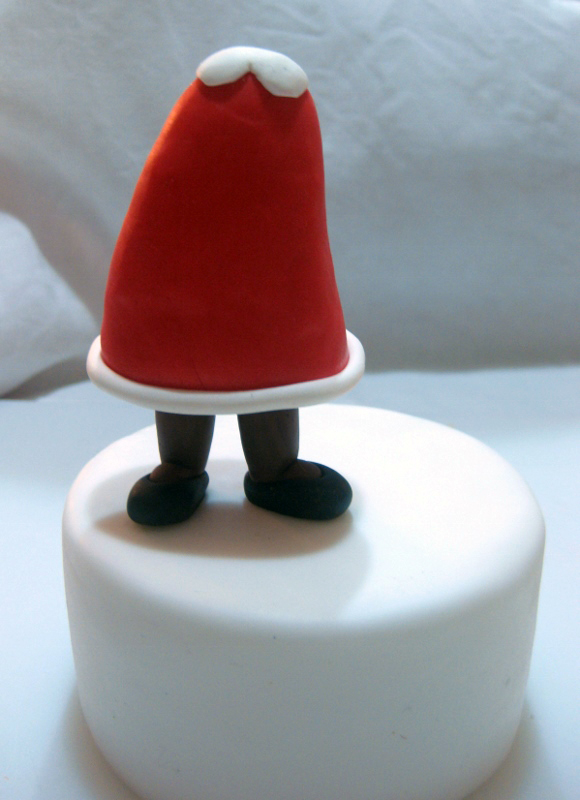
What are the coordinates of `white podium` in the screenshot? It's located at (327, 574), (387, 450).